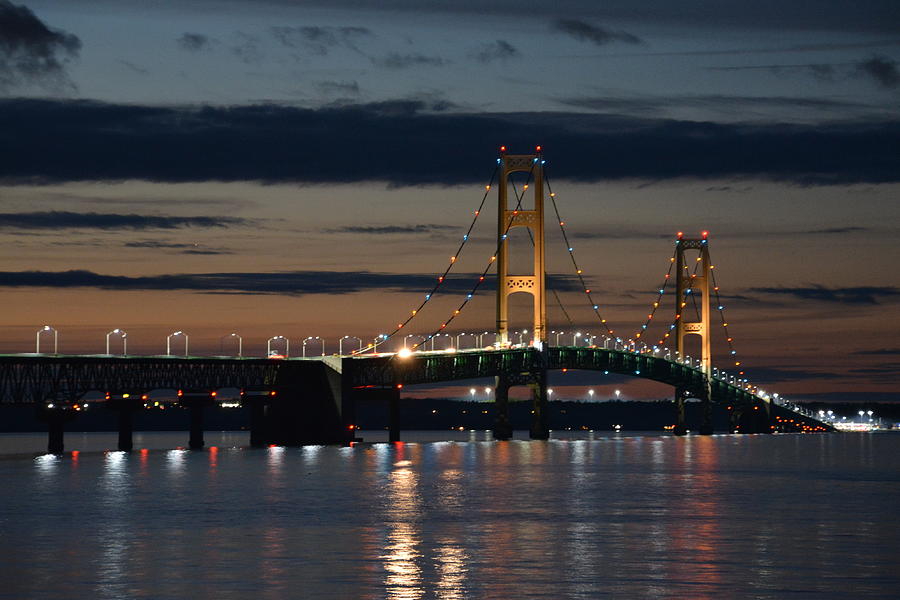
Identify the location of colored lights. (564, 245), (463, 252), (473, 271), (642, 323), (668, 334), (731, 346).